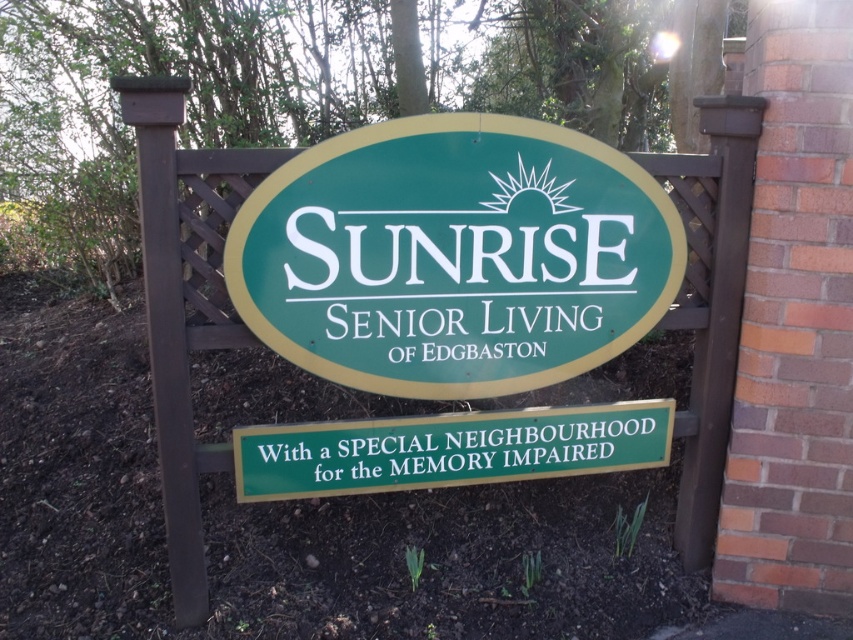
Question: Can you confirm if green plastic sign at center is positioned to the left of green matte signboard at center?

Choices:
 (A) no
 (B) yes

Answer: (A)

Question: Does green plastic sign at center have a greater width compared to green matte signboard at center?

Choices:
 (A) yes
 (B) no

Answer: (B)

Question: Among these points, which one is farthest from the camera?

Choices:
 (A) (338, 472)
 (B) (428, 177)

Answer: (A)

Question: Does green plastic sign at center appear on the left side of green matte signboard at center?

Choices:
 (A) yes
 (B) no

Answer: (B)

Question: Among these points, which one is farthest from the camera?

Choices:
 (A) (233, 461)
 (B) (447, 214)

Answer: (A)